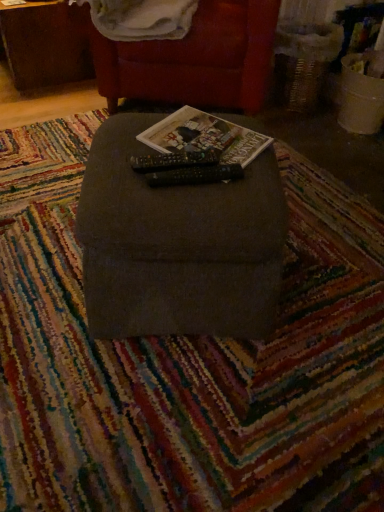
Question: Could you tell me if white soft blanket at upper center is turned towards brown wood table at upper left?

Choices:
 (A) yes
 (B) no

Answer: (B)

Question: Is white soft blanket at upper center to the left of brown wood table at upper left from the viewer's perspective?

Choices:
 (A) no
 (B) yes

Answer: (A)

Question: From the image's perspective, does white soft blanket at upper center appear higher than brown wood table at upper left?

Choices:
 (A) no
 (B) yes

Answer: (A)

Question: Can you confirm if white soft blanket at upper center is smaller than brown wood table at upper left?

Choices:
 (A) no
 (B) yes

Answer: (B)

Question: From the image's perspective, is white soft blanket at upper center under brown wood table at upper left?

Choices:
 (A) yes
 (B) no

Answer: (A)

Question: Considering the relative sizes of white soft blanket at upper center and brown wood table at upper left in the image provided, is white soft blanket at upper center wider than brown wood table at upper left?

Choices:
 (A) no
 (B) yes

Answer: (A)

Question: Can you confirm if brown wood table at upper left is taller than velvet red armchair at upper center, which appears as the 1th furniture when viewed from the back?

Choices:
 (A) yes
 (B) no

Answer: (B)

Question: From a real-world perspective, is brown wood table at upper left below velvet red armchair at upper center, the 2th furniture from the front?

Choices:
 (A) yes
 (B) no

Answer: (A)

Question: Considering the relative sizes of brown wood table at upper left and velvet red armchair at upper center, the 2th furniture from the front, in the image provided, is brown wood table at upper left smaller than velvet red armchair at upper center, the 2th furniture from the front,?

Choices:
 (A) no
 (B) yes

Answer: (B)

Question: Does brown wood table at upper left come in front of velvet red armchair at upper center, which appears as the 1th furniture when viewed from the back?

Choices:
 (A) no
 (B) yes

Answer: (A)

Question: Does brown wood table at upper left have a greater width compared to velvet red armchair at upper center, the 1th furniture viewed from the top?

Choices:
 (A) yes
 (B) no

Answer: (B)

Question: Is brown wood table at upper left positioned with its back to velvet red armchair at upper center, the 2th furniture from the front?

Choices:
 (A) yes
 (B) no

Answer: (B)

Question: Could you tell me if dark gray fabric ottoman at center, the first furniture positioned from the front, is facing white soft blanket at upper center?

Choices:
 (A) yes
 (B) no

Answer: (B)